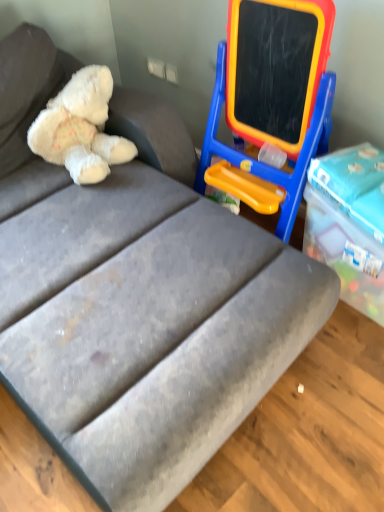
Question: From a real-world perspective, is white plush teddy bear at upper left located higher than blue plastic easel at upper right?

Choices:
 (A) yes
 (B) no

Answer: (A)

Question: Does white plush teddy bear at upper left turn towards blue plastic easel at upper right?

Choices:
 (A) yes
 (B) no

Answer: (B)

Question: Considering the relative positions of white plush teddy bear at upper left and blue plastic easel at upper right in the image provided, is white plush teddy bear at upper left to the left of blue plastic easel at upper right from the viewer's perspective?

Choices:
 (A) yes
 (B) no

Answer: (A)

Question: From the image's perspective, is white plush teddy bear at upper left on blue plastic easel at upper right?

Choices:
 (A) yes
 (B) no

Answer: (A)

Question: Can you confirm if white plush teddy bear at upper left is taller than blue plastic easel at upper right?

Choices:
 (A) yes
 (B) no

Answer: (B)

Question: Considering the relative sizes of white plush teddy bear at upper left and blue plastic easel at upper right in the image provided, is white plush teddy bear at upper left bigger than blue plastic easel at upper right?

Choices:
 (A) no
 (B) yes

Answer: (A)

Question: From the image's perspective, does blue plastic easel at upper right appear higher than white plush teddy bear at upper left?

Choices:
 (A) yes
 (B) no

Answer: (B)

Question: Can we say blue plastic easel at upper right lies outside white plush teddy bear at upper left?

Choices:
 (A) no
 (B) yes

Answer: (B)

Question: Considering the relative sizes of blue plastic easel at upper right and white plush teddy bear at upper left in the image provided, is blue plastic easel at upper right shorter than white plush teddy bear at upper left?

Choices:
 (A) no
 (B) yes

Answer: (A)

Question: Is the depth of blue plastic easel at upper right greater than that of white plush teddy bear at upper left?

Choices:
 (A) no
 (B) yes

Answer: (A)

Question: Does blue plastic easel at upper right have a lesser width compared to white plush teddy bear at upper left?

Choices:
 (A) no
 (B) yes

Answer: (B)

Question: Is blue plastic easel at upper right positioned with its back to white plush teddy bear at upper left?

Choices:
 (A) no
 (B) yes

Answer: (A)

Question: Would you say white plush teddy bear at upper left is to the left or to the right of blue plastic easel at upper right in the picture?

Choices:
 (A) left
 (B) right

Answer: (A)